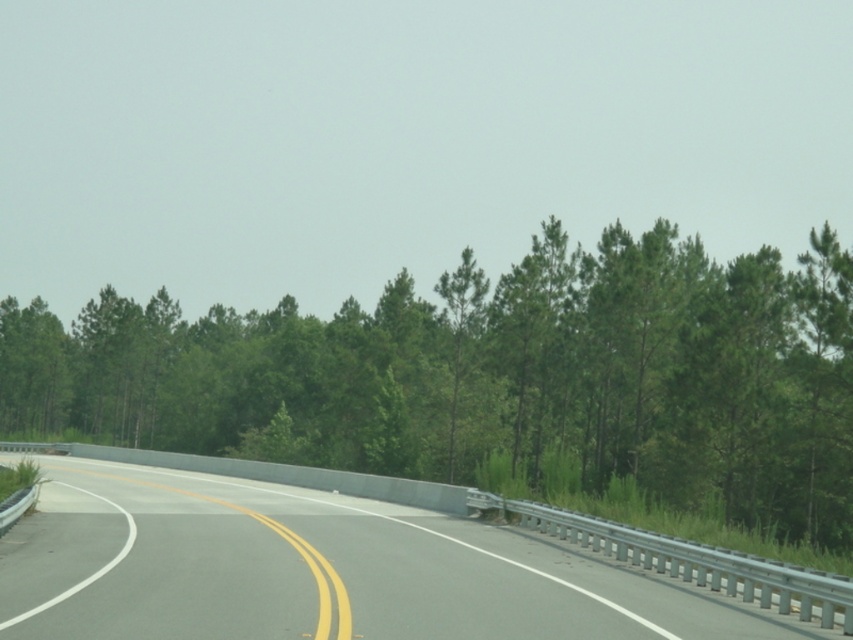
Which is more to the left, green leafy tree at center or gray asphalt highway at center?

green leafy tree at center is more to the left.

Find the location of `green leafy tree at center`. green leafy tree at center is located at coordinates (495, 380).

Between point (505, 371) and point (293, 598), which one is positioned behind?

Point (505, 371)

Image resolution: width=853 pixels, height=640 pixels. Identify the location of green leafy tree at center. (495, 380).